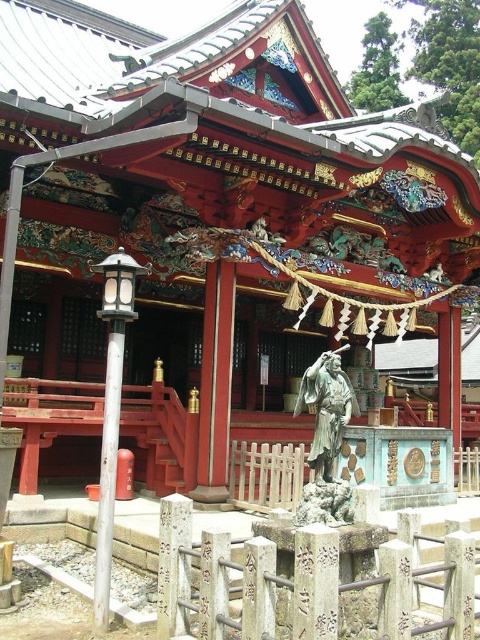
Is bronze statue at center positioned at the back of white stone pillar at center?

Yes, it is.

Locate an element on the screen. The width and height of the screenshot is (480, 640). bronze statue at center is located at coordinates (326, 410).